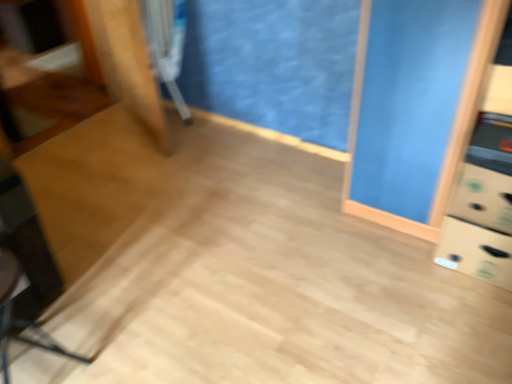
The height and width of the screenshot is (384, 512). I want to click on vacant space that is in between black plastic swivel chair at lower left, which appears as the 2th swivel chair when viewed from the back, and metallic silver swivel chair at upper left, acting as the 2th swivel chair starting from the front, so click(125, 220).